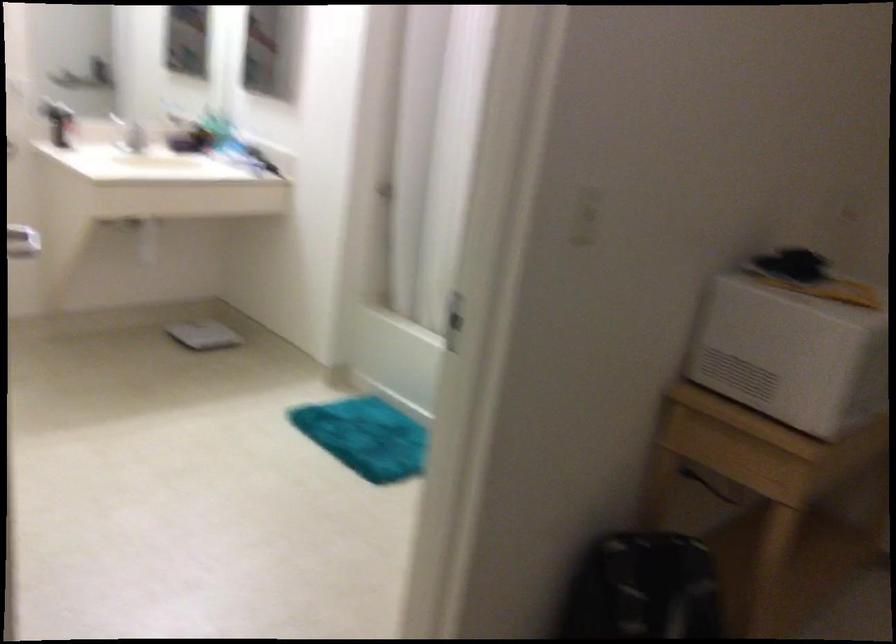
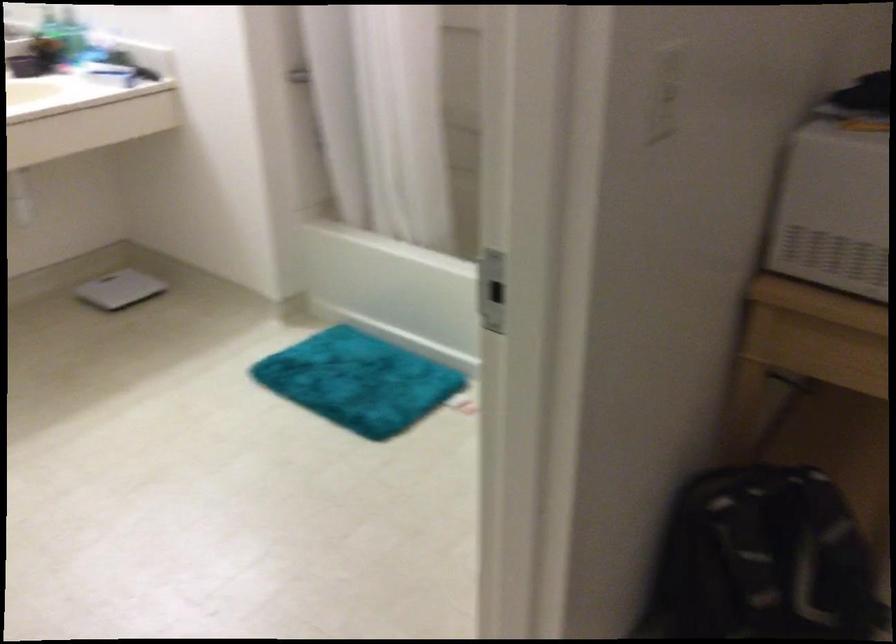
Where in the second image is the point corresponding to point 372,436 from the first image?

(358, 381)